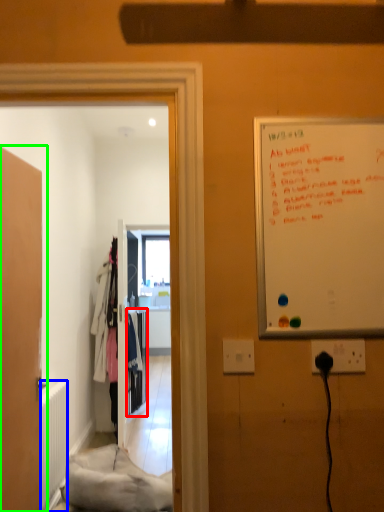
Question: Which is farther away from closet (highlighted by a red box)? radiator (highlighted by a blue box) or door (highlighted by a green box)?

Choices:
 (A) radiator
 (B) door

Answer: (B)